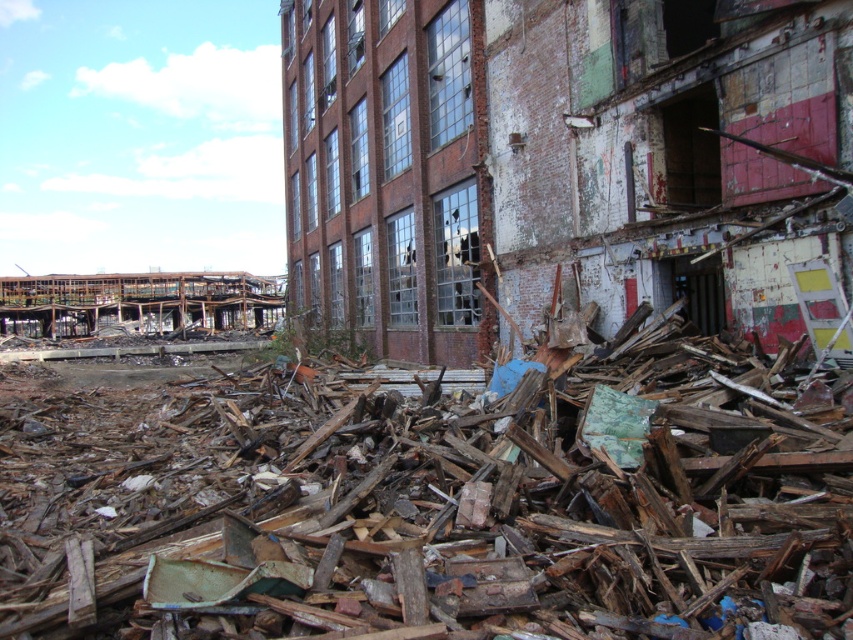
Question: Which point is farther from the camera taking this photo?

Choices:
 (A) (285, 51)
 (B) (155, 577)

Answer: (A)

Question: Can you confirm if brown wood debris at center is wider than crumbled brick wall at center?

Choices:
 (A) yes
 (B) no

Answer: (B)

Question: Does brown wood debris at center have a lesser width compared to crumbled brick wall at center?

Choices:
 (A) yes
 (B) no

Answer: (A)

Question: Which point is farther to the camera?

Choices:
 (A) (590, 368)
 (B) (346, 54)

Answer: (B)

Question: Is brown wood debris at center smaller than crumbled brick wall at center?

Choices:
 (A) no
 (B) yes

Answer: (B)

Question: Which of the following is the closest to the observer?

Choices:
 (A) crumbled brick wall at center
 (B) brown wood debris at center

Answer: (B)